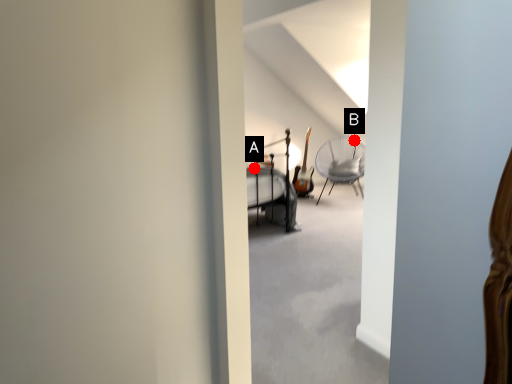
Question: Two points are circled on the image, labeled by A and B beside each circle. Which point is closer to the camera?

Choices:
 (A) A is closer
 (B) B is closer

Answer: (A)